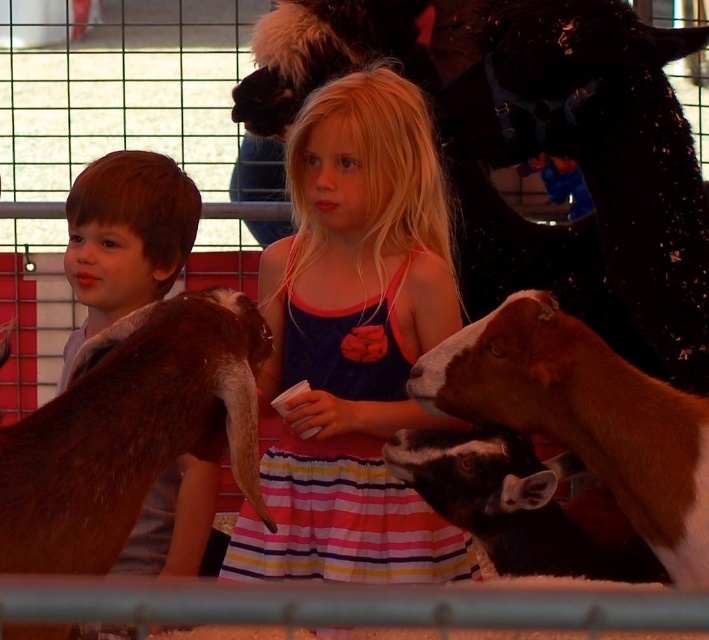
Can you confirm if matte blue dress at center is smaller than brown fuzzy goat at lower right?

Incorrect, matte blue dress at center is not smaller in size than brown fuzzy goat at lower right.

Consider the image. Is matte blue dress at center positioned in front of brown fuzzy goat at lower right?

No.

Between point (337, 83) and point (654, 508), which one is positioned behind?

Positioned behind is point (337, 83).

I want to click on matte blue dress at center, so click(352, 342).

Between matte blue dress at center and brown fur at left, which one is positioned higher?

Positioned higher is brown fur at left.

Looking at this image, who is more distant from viewer, (323, 298) or (113, 298)?

The point (113, 298) is behind.

Where is `matte blue dress at center`? matte blue dress at center is located at coordinates (352, 342).

Can you confirm if brown fuzzy goat at left is thinner than brown fuzzy goat at lower right?

Correct, brown fuzzy goat at left's width is less than brown fuzzy goat at lower right's.

Describe the element at coordinates (130, 429) in the screenshot. I see `brown fuzzy goat at left` at that location.

The height and width of the screenshot is (640, 709). I want to click on brown fuzzy goat at left, so click(130, 429).